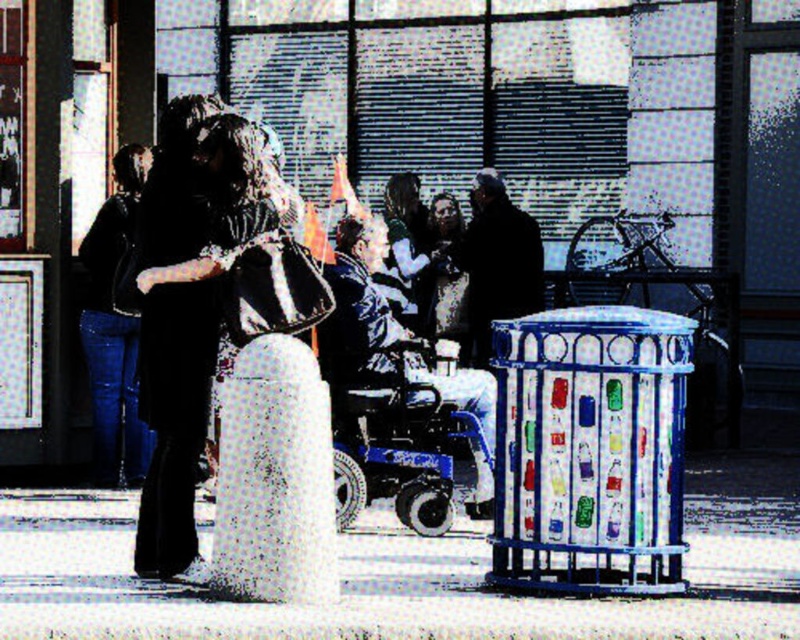
Question: Is black fabric dress at center further to the viewer compared to dark brown leather jacket at center?

Choices:
 (A) yes
 (B) no

Answer: (B)

Question: Which of these objects is positioned farthest from the blue plastic wheelchair at center?

Choices:
 (A) dark brown leather jacket at center
 (B) white concrete pavement at lower center
 (C) denim jacket at left
 (D) matte black dress at center

Answer: (D)

Question: Does white concrete pavement at lower center appear on the right side of black fabric dress at center?

Choices:
 (A) no
 (B) yes

Answer: (B)

Question: Estimate the real-world distances between objects in this image. Which object is farther from the blue plastic wheelchair at center?

Choices:
 (A) matte black dress at center
 (B) denim jacket at left
 (C) white concrete pavement at lower center

Answer: (A)

Question: Which object is the farthest from the blue plastic wheelchair at center?

Choices:
 (A) black fabric dress at center
 (B) denim jacket at left
 (C) dark brown leather jacket at center
 (D) matte black dress at center

Answer: (D)

Question: Is denim jacket at left positioned before matte black dress at center?

Choices:
 (A) yes
 (B) no

Answer: (A)